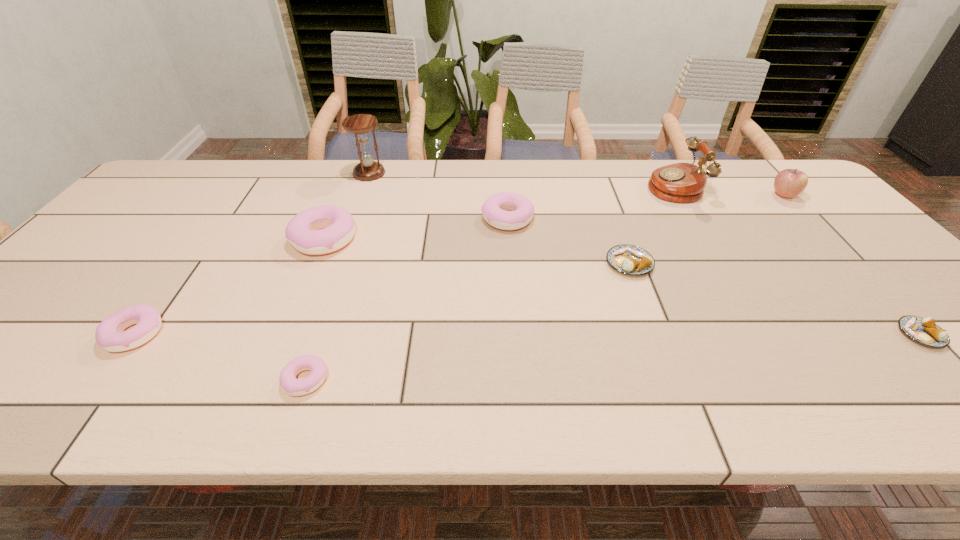
This screenshot has width=960, height=540. In order to click on object present at the near edge in this screenshot , I will do pyautogui.click(x=295, y=387).

You are a GUI agent. You are given a task and a screenshot of the screen. Output one action in this format:
    pyautogui.click(x=<x>, y=<y>)
    Task: Click on the apple that is at the right edge
    The height and width of the screenshot is (540, 960).
    Given the screenshot: What is the action you would take?
    pyautogui.click(x=788, y=183)

Where is `pastry that is positioned at the right edge`? This screenshot has height=540, width=960. pastry that is positioned at the right edge is located at coordinates (922, 330).

Image resolution: width=960 pixels, height=540 pixels. Identify the location of object that is at the far right corner. (788, 183).

At what (x,y) coordinates should I click in order to perform the action: click on free spot at the far edge of the desktop. Please return your answer as a coordinate pair (x, y). Looking at the image, I should click on (732, 167).

The height and width of the screenshot is (540, 960). I want to click on vacant position at the near edge of the desktop, so click(611, 376).

The image size is (960, 540). What are the coordinates of `free space at the left edge of the desktop` in the screenshot? It's located at (124, 277).

What are the coordinates of `free space at the right edge of the desktop` in the screenshot? It's located at (792, 206).

Identify the location of vacant space that is in between the third tallest object and the fourth tallest object. (554, 217).

Identify the location of empty location between the seventh shortest object and the hourglass. (577, 184).